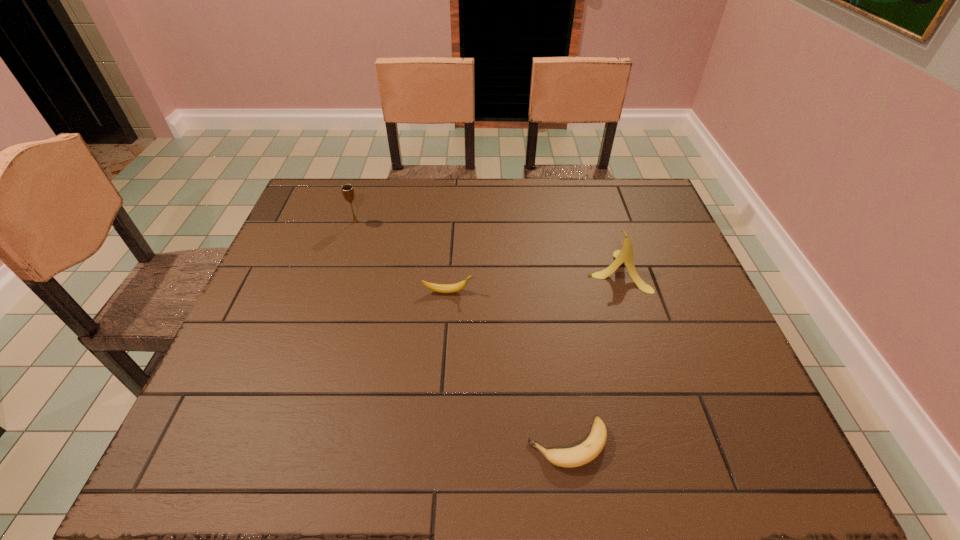
Locate an element on the screen. This screenshot has height=540, width=960. the rightmost banana is located at coordinates (625, 255).

Find the location of a particular element. the tallest banana is located at coordinates (625, 255).

Locate an element on the screen. The width and height of the screenshot is (960, 540). the farthest object is located at coordinates (347, 190).

Image resolution: width=960 pixels, height=540 pixels. In order to click on chalice in this screenshot , I will do `click(347, 190)`.

Locate an element on the screen. The image size is (960, 540). the second tallest banana is located at coordinates (441, 288).

At what (x,y) coordinates should I click in order to perform the action: click on the second shortest object. Please return your answer as a coordinate pair (x, y). Looking at the image, I should click on (441, 288).

The height and width of the screenshot is (540, 960). What are the coordinates of `the shortest banana` in the screenshot? It's located at (577, 456).

This screenshot has width=960, height=540. Find the location of `the third object from left to right`. the third object from left to right is located at coordinates (577, 456).

Locate an element on the screen. This screenshot has width=960, height=540. vacant region located 0.110m on the back of the rightmost banana is located at coordinates (603, 226).

The width and height of the screenshot is (960, 540). Find the location of `free location located 0.140m on the right of the chalice`. free location located 0.140m on the right of the chalice is located at coordinates [408, 222].